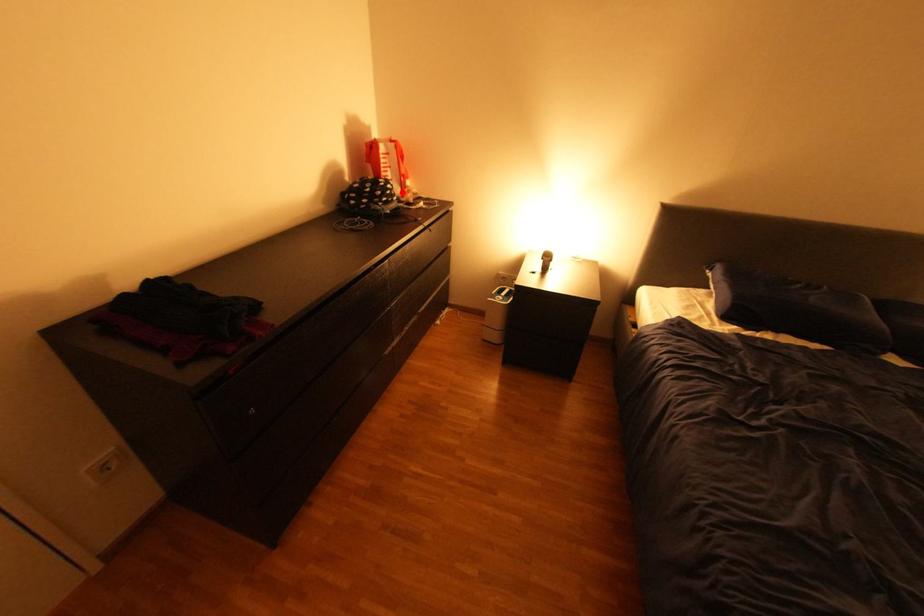
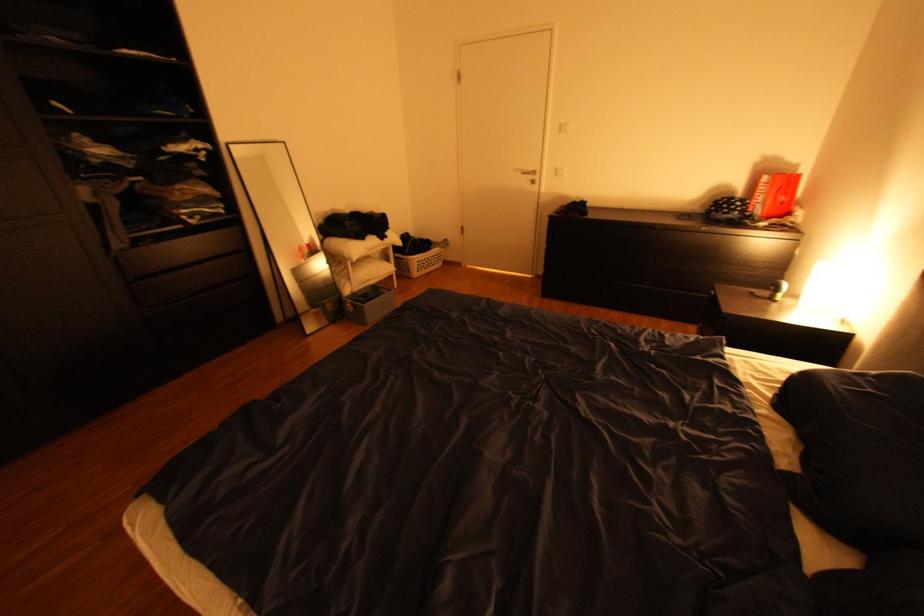
The point at the highlighted location is marked in the first image. Where is the corresponding point in the second image?

(748, 208)